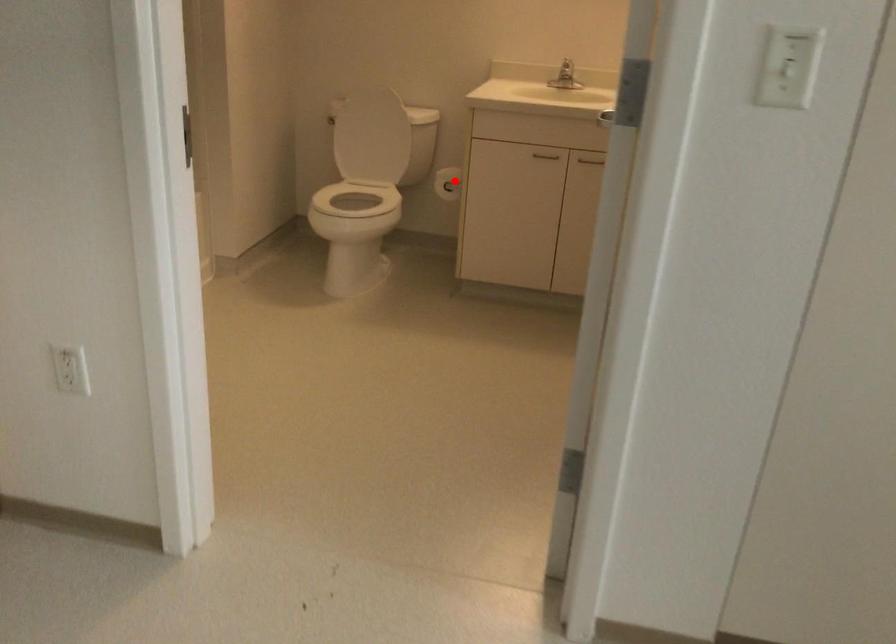
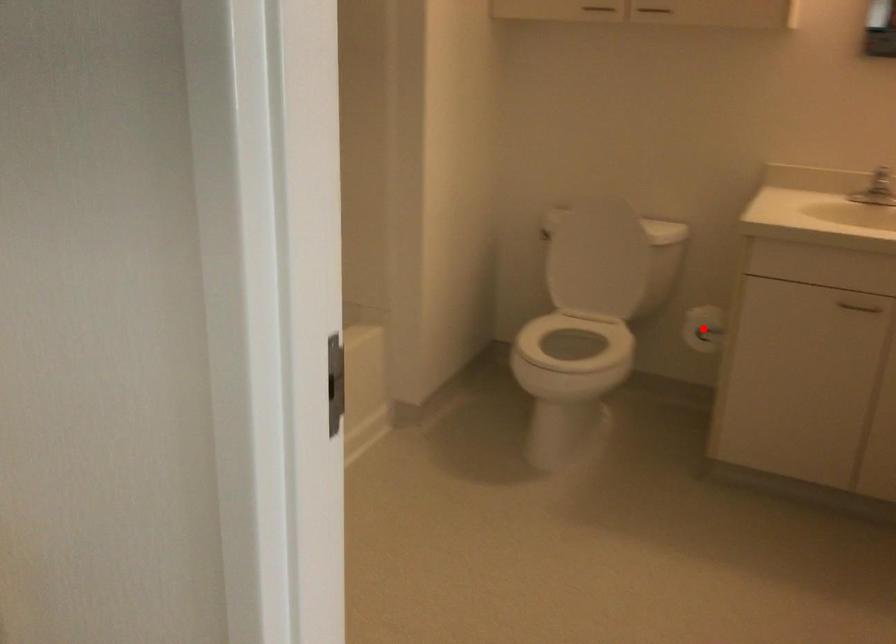
From the picture: I am providing you with two images of the same scene from different viewpoints. A red point is marked on the first image and another point is marked on the second image. Are the points marked in image1 and image2 representing the same 3D position?

Yes